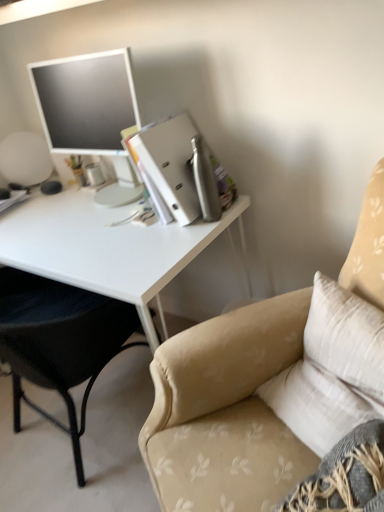
I want to click on free point below beige fabric chair at left, the first chair positioned from the left (from a real-world perspective), so pos(64,436).